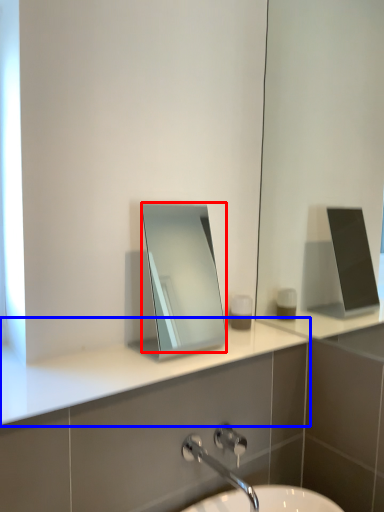
Question: Which of the following is the closest to the observer, mirror (highlighted by a red box) or counter top (highlighted by a blue box)?

Choices:
 (A) mirror
 (B) counter top

Answer: (B)